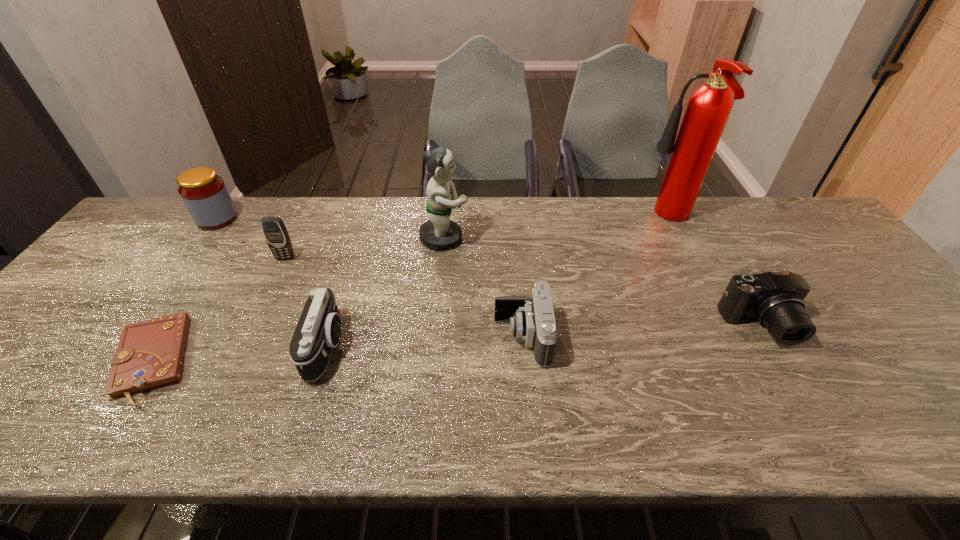
Identify the location of free region at the far left corner of the desktop. (163, 199).

Locate an element on the screen. free space at the far right corner of the desktop is located at coordinates (801, 233).

In order to click on free space between the rightmost camera and the jar in this screenshot , I will do `click(489, 272)`.

You are a GUI agent. You are given a task and a screenshot of the screen. Output one action in this format:
    pyautogui.click(x=<x>, y=<y>)
    Task: Click on the free area in between the rightmost camera and the tallest object
    The image size is (960, 540).
    Given the screenshot: What is the action you would take?
    pyautogui.click(x=714, y=272)

Image resolution: width=960 pixels, height=540 pixels. I want to click on free point between the leftmost camera and the fourth object from right to left, so click(386, 292).

Identify the location of free point between the fourth farthest object and the sixth object from left to right. (404, 298).

Find the location of a particular element. This screenshot has height=540, width=960. vacant space that's between the second tallest object and the fire extinguisher is located at coordinates (557, 228).

I want to click on vacant region between the fire extinguisher and the shortest object, so click(x=410, y=289).

Locate an element on the screen. The image size is (960, 540). vacant point located between the leftmost camera and the seventh shortest object is located at coordinates pyautogui.click(x=386, y=292).

Locate an element on the screen. Image resolution: width=960 pixels, height=540 pixels. free space between the figurine and the rightmost camera is located at coordinates (603, 282).